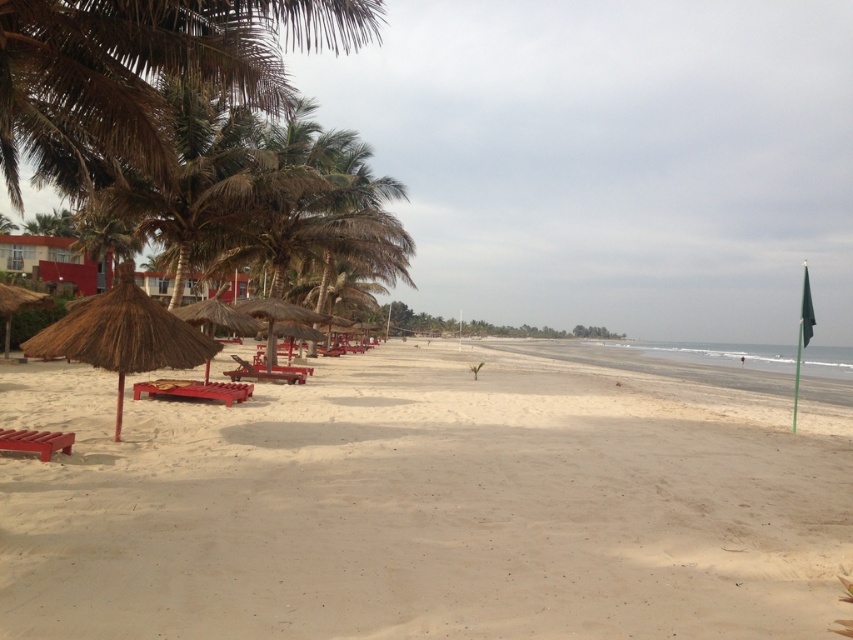
Does point (195, 333) lie in front of point (281, 301)?

Yes, point (195, 333) is closer to viewer.

Measure the distance between point [105,339] and camera.

Point [105,339] is 8.23 meters from camera.

This screenshot has width=853, height=640. What are the coordinates of `thatched straw umbrella at left` in the screenshot? It's located at (123, 336).

Is beige sandy beach at left to the right of brown thatch umbrella at center from the viewer's perspective?

Indeed, beige sandy beach at left is positioned on the right side of brown thatch umbrella at center.

Is beige sandy beach at left below brown thatch umbrella at center?

Indeed, beige sandy beach at left is positioned under brown thatch umbrella at center.

Who is more distant from viewer, (665, 358) or (293, 317)?

The point (665, 358) is more distant.

Find the location of `beige sandy beach at left`. beige sandy beach at left is located at coordinates (433, 500).

Is beige sandy beach at left wider than thatched straw umbrella at left?

Yes, beige sandy beach at left is wider than thatched straw umbrella at left.

Is the position of beige sandy beach at left more distant than that of thatched straw umbrella at left?

No, it is not.

Which is behind, point (575, 365) or point (161, 356)?

The point (575, 365) is behind.

Where is `beige sandy beach at left`? beige sandy beach at left is located at coordinates (433, 500).